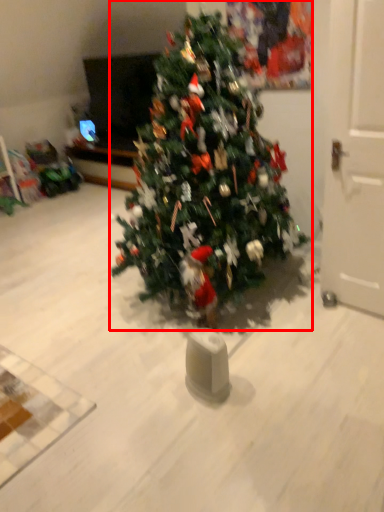
Question: Observing the image, what is the correct spatial positioning of christmas tree (annotated by the red box) in reference to door?

Choices:
 (A) left
 (B) right

Answer: (A)